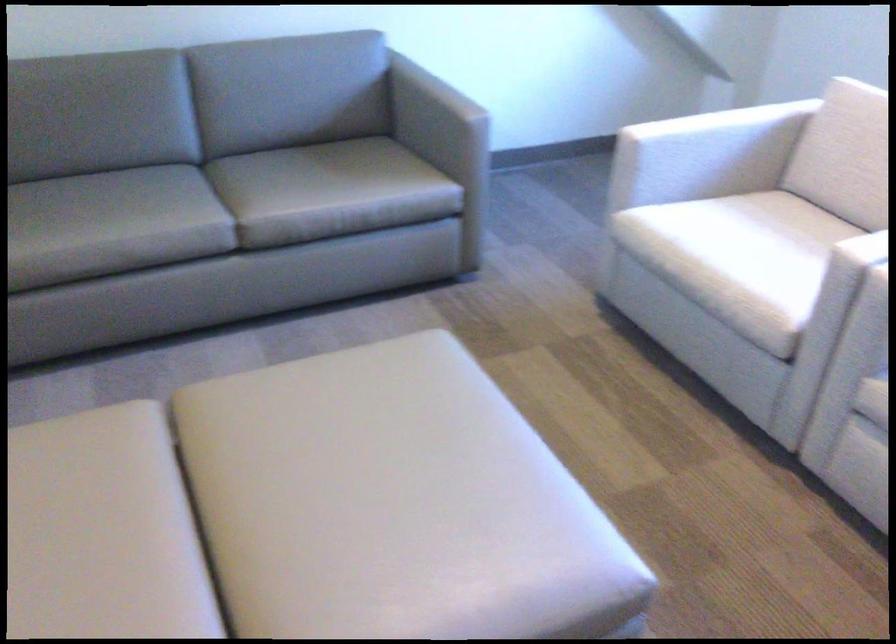
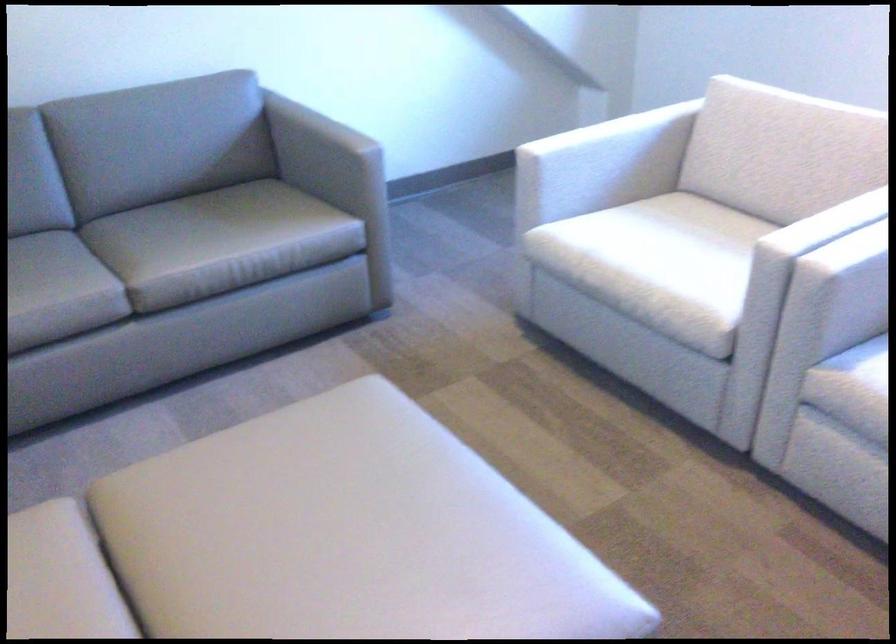
The images are taken continuously from a first-person perspective. In which direction are you moving?

The movement direction of the cameraman is left, forward.